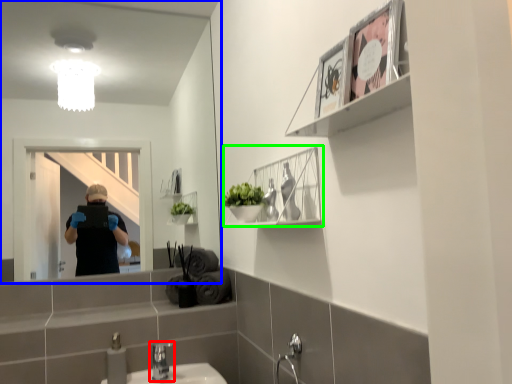
Question: Estimate the real-world distances between objects in this image. Which object is closer to tap (highlighted by a red box), mirror (highlighted by a blue box) or cabinet (highlighted by a green box)?

Choices:
 (A) mirror
 (B) cabinet

Answer: (B)